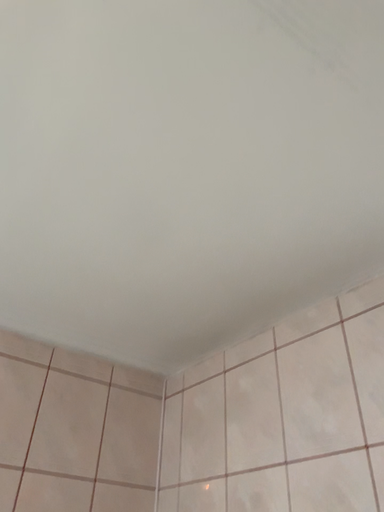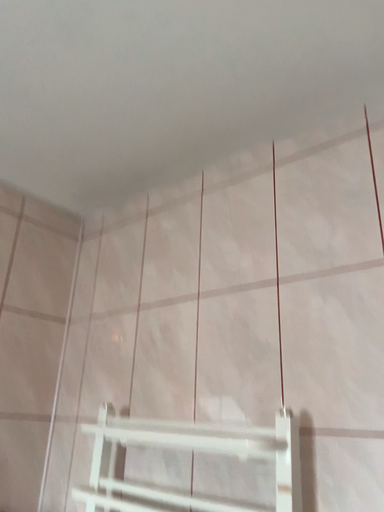
Question: How did the camera likely rotate when shooting the video?

Choices:
 (A) rotated right
 (B) rotated left

Answer: (A)